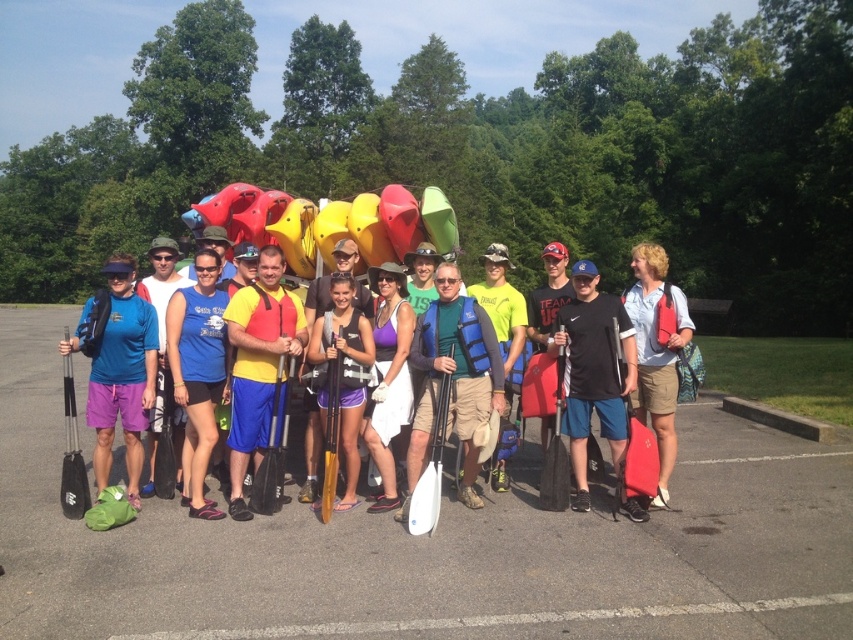
Question: Considering the relative positions of black rubber paddle at center and light blue shirt at center in the image provided, where is black rubber paddle at center located with respect to light blue shirt at center?

Choices:
 (A) right
 (B) left

Answer: (B)

Question: Can you confirm if black rubber paddle at center is bigger than yellow life vest at center?

Choices:
 (A) no
 (B) yes

Answer: (B)

Question: Is yellow life vest at center wider than light blue shirt at center?

Choices:
 (A) yes
 (B) no

Answer: (B)

Question: Which point is closer to the camera?

Choices:
 (A) matte blue shirt at center
 (B) yellow life vest at center

Answer: (A)

Question: Which is farther from the yellow life vest at center?

Choices:
 (A) light blue shirt at center
 (B) black rubber paddle at center
 (C) matte blue shirt at center

Answer: (B)

Question: Estimate the real-world distances between objects in this image. Which object is farther from the yellow life vest at center?

Choices:
 (A) light blue shirt at center
 (B) matte blue shirt at center

Answer: (B)